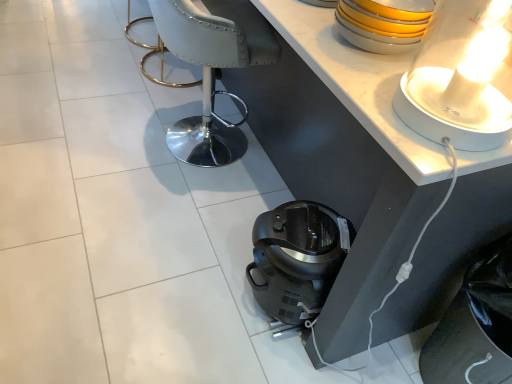
I want to click on free space in front of white leather armchair at center, so click(x=172, y=195).